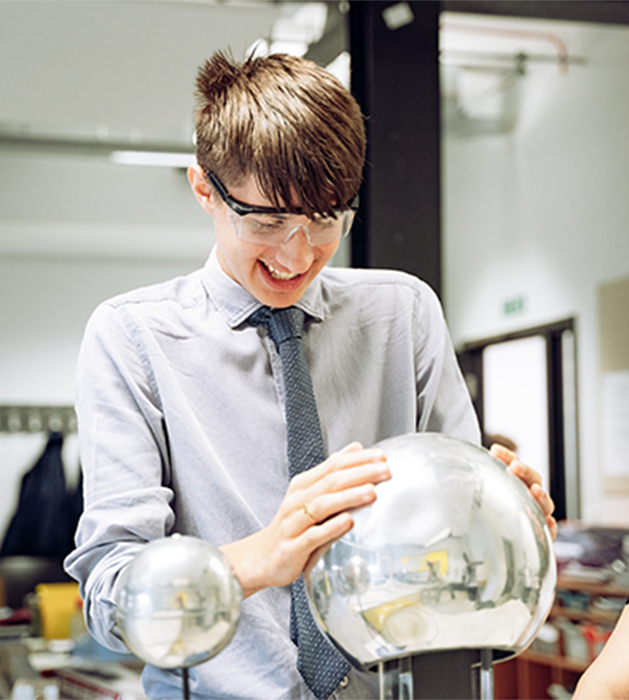
Identify the location of reflective globe. (428, 573), (175, 606).